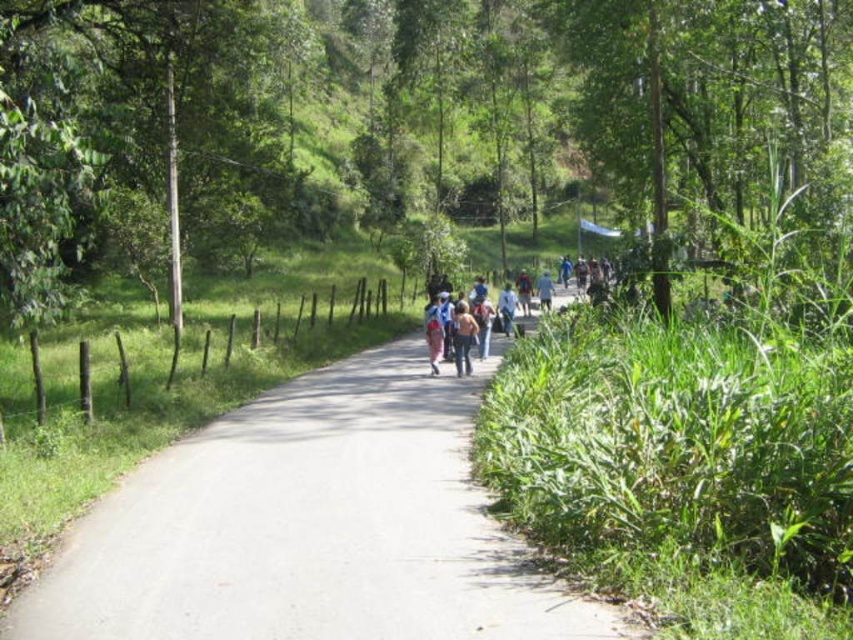
Question: Which point is closer to the camera?

Choices:
 (A) (515, 330)
 (B) (465, 372)
 (C) (339, 518)

Answer: (C)

Question: Which is nearer to the denim jacket at center?

Choices:
 (A) gray asphalt road at center
 (B) matte blue backpack at center

Answer: (B)

Question: Which object is the closest to the denim jacket at center?

Choices:
 (A) gray asphalt road at center
 (B) matte blue backpack at center

Answer: (B)

Question: Is gray asphalt road at center wider than denim jacket at center?

Choices:
 (A) yes
 (B) no

Answer: (A)

Question: Considering the relative positions of matte blue backpack at center and denim jacket at center in the image provided, where is matte blue backpack at center located with respect to denim jacket at center?

Choices:
 (A) above
 (B) below

Answer: (A)

Question: Can you confirm if gray asphalt road at center is positioned to the left of matte blue backpack at center?

Choices:
 (A) no
 (B) yes

Answer: (B)